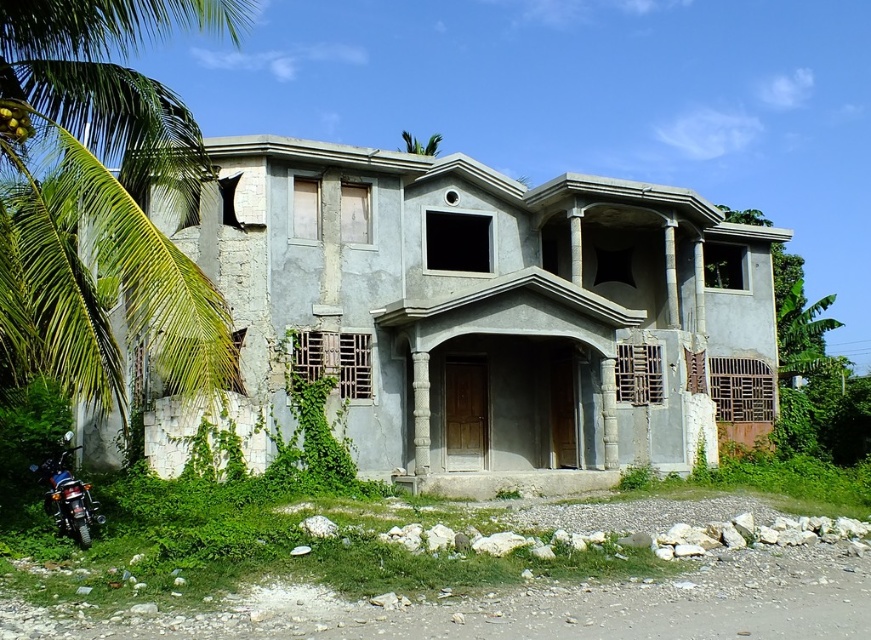
You are a delivery person who needs to park your motorcycle in a spot that is not blocked by the green leafy palm tree at left. Based on the scene, where should you move the shiny black motorbike at lower left to avoid the palm tree?

The green leafy palm tree at left is positioned on the left side of the shiny black motorbike at lower left, so moving the shiny black motorbike at lower left to the right side of the palm tree would keep it unobstructed.

You are standing in front of the abandoned building and want to take a photo of the shiny black motorbike at lower left without the green leafy palm tree at left blocking the view. Is the palm tree currently blocking the motorbike in the scene?

The green leafy palm tree at left is located above the shiny black motorbike at lower left, so it is blocking the view of the motorbike.